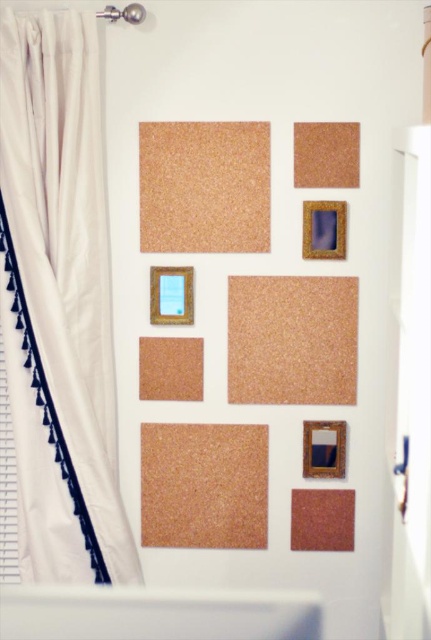
You are hanging a new picture frame on the wall. The picture frame is the same width as the white fabric curtain at left. Will it fit within the width of the cork board at upper center?

The white fabric curtain at left has a lesser width compared to the cork board at upper center. Therefore, the picture frame with the same width as the white fabric curtain at left will fit within the width of the cork board at upper center.

You are hanging a new picture frame between the white fabric curtain at left and the cork board at upper center. Which object should you place it closer to if you want the frame to be centered between them?

You should place the new picture frame closer to the white fabric curtain at left because it is positioned on the left side of the cork board at upper center, so the center between them would be closer to the curtain.

You are hanging a new photo on the wall and need to choose between placing it on the cork board at upper center or the gold textured picture frame at center. Which surface can accommodate a wider photo?

The cork board at upper center might be wider than the gold textured picture frame at center, so it can likely accommodate a wider photo.